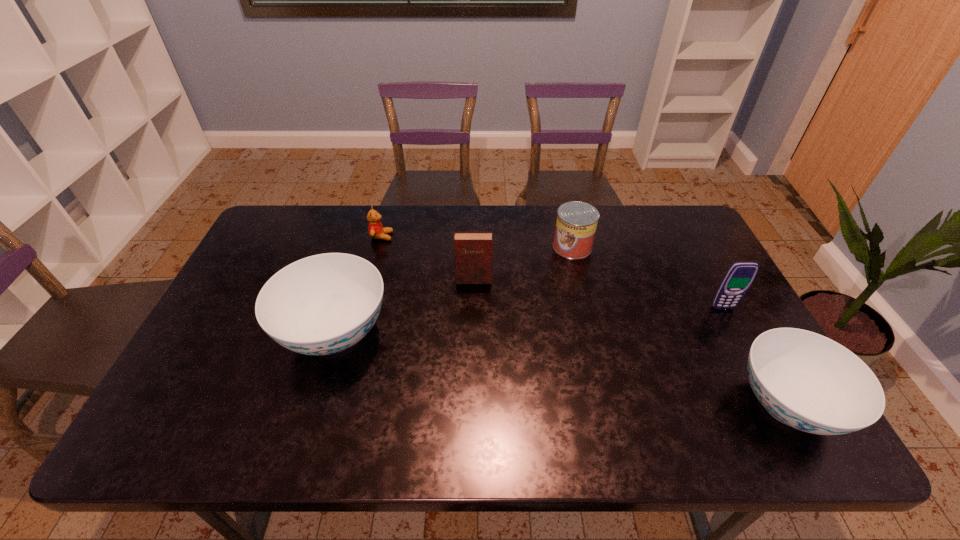
Locate an element on the screen. vacant spot for a new chinaware to ensure equal spacing is located at coordinates (545, 367).